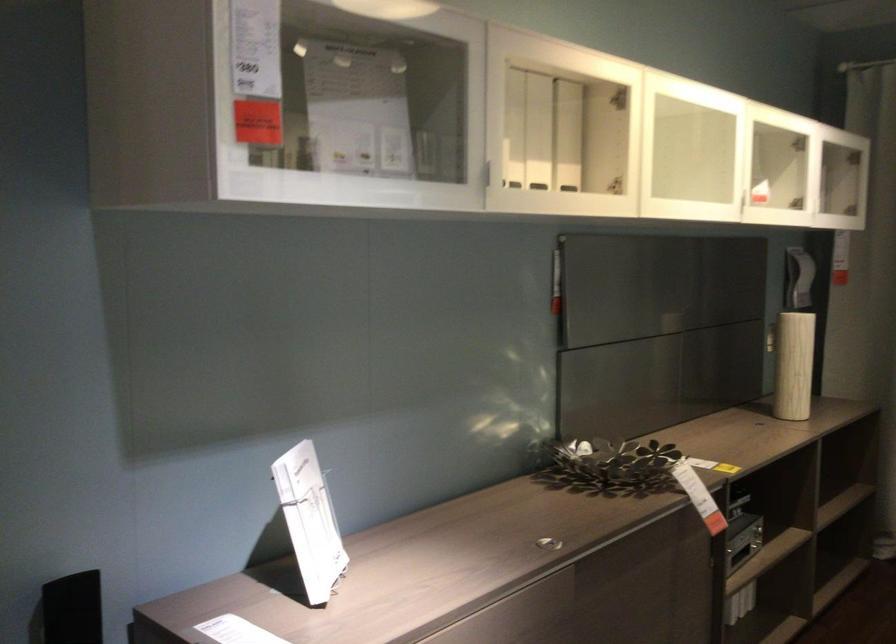
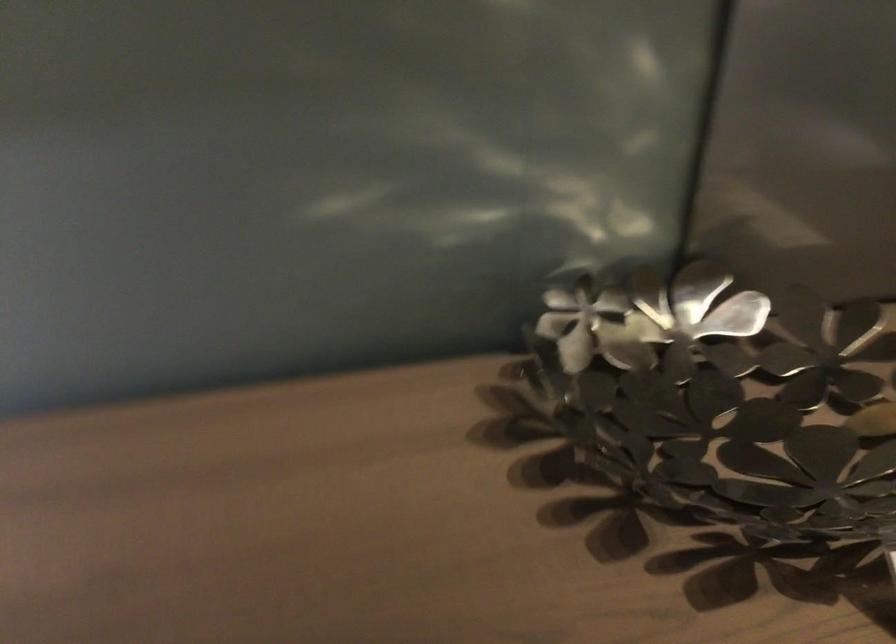
In the second image, find the point that corresponds to point (592, 473) in the first image.

(721, 399)